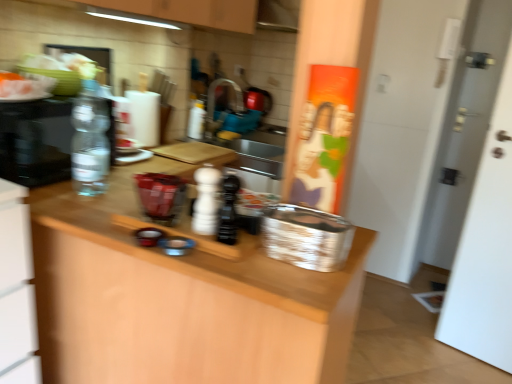
Measure the distance between white matte pepper shaker at center, arranged as the 2th bottle when viewed from the front, and camera.

A distance of 3.35 feet exists between white matte pepper shaker at center, arranged as the 2th bottle when viewed from the front, and camera.

What do you see at coordinates (306, 237) in the screenshot? The height and width of the screenshot is (384, 512). I see `silver metallic basket at center` at bounding box center [306, 237].

The height and width of the screenshot is (384, 512). In order to click on silver metallic basket at center in this screenshot , I will do point(306,237).

What is the approximate height of wooden at center?

The height of wooden at center is 92.17 centimeters.

I want to click on clear glass water bottle at left, so click(36, 141).

Where is `white matte pepper shaker at center, placed as the 3th bottle when sorted from back to front`? The image size is (512, 384). white matte pepper shaker at center, placed as the 3th bottle when sorted from back to front is located at coordinates (206, 200).

Looking at their sizes, would you say white matte pepper shaker at center, the second bottle positioned from the right, is wider or thinner than translucent plastic bottle at center, acting as the first bottle starting from the back?

white matte pepper shaker at center, the second bottle positioned from the right, is wider than translucent plastic bottle at center, acting as the first bottle starting from the back.

Is point (207, 177) farther from camera compared to point (193, 113)?

No, it is not.

From the image's perspective, which bottle is the 2nd one above the white matte pepper shaker at center, arranged as the 2th bottle when viewed from the front? Please provide its 2D coordinates.

[(196, 121)]

Measure the distance from white matte pepper shaker at center, placed as the 3th bottle when sorted from back to front, to translucent plastic bottle at center, arranged as the third bottle when viewed from the right.

white matte pepper shaker at center, placed as the 3th bottle when sorted from back to front, is 3.92 feet away from translucent plastic bottle at center, arranged as the third bottle when viewed from the right.

Considering the relative positions of silver metallic basket at center and wooden at center in the image provided, is silver metallic basket at center to the right of wooden at center from the viewer's perspective?

Yes.

Which of these two, silver metallic basket at center or wooden at center, stands shorter?

silver metallic basket at center.

Can we say silver metallic basket at center lies outside wooden at center?

Yes, silver metallic basket at center is outside of wooden at center.

Where is `basket above the wooden at center (from a real-world perspective)`? The image size is (512, 384). basket above the wooden at center (from a real-world perspective) is located at coordinates (306, 237).

From a real-world perspective, is translucent plastic bottle at center, which appears as the second bottle when viewed from the left, positioned above or below clear glass water bottle at left?

translucent plastic bottle at center, which appears as the second bottle when viewed from the left, is below clear glass water bottle at left.

Which object is wider, translucent plastic bottle at center, which appears as the second bottle when viewed from the left, or clear glass water bottle at left?

clear glass water bottle at left is wider.

At what (x,y) coordinates should I click in order to perform the action: click on the 2nd bottle behind when counting from the clear glass water bottle at left. Please return your answer as a coordinate pair (x, y). This screenshot has width=512, height=384. Looking at the image, I should click on (196, 121).

Can you confirm if transparent plastic bottle at left, acting as the third bottle starting from the front, is thinner than translucent plastic bottle at center, marked as the 4th bottle in a front-to-back arrangement?

No, transparent plastic bottle at left, acting as the third bottle starting from the front, is not thinner than translucent plastic bottle at center, marked as the 4th bottle in a front-to-back arrangement.

From a real-world perspective, relative to translucent plastic bottle at center, marked as the 4th bottle in a front-to-back arrangement, is transparent plastic bottle at left, which is the 2th bottle from back to front, vertically above or below?

Clearly, from a real-world perspective, transparent plastic bottle at left, which is the 2th bottle from back to front, is above translucent plastic bottle at center, marked as the 4th bottle in a front-to-back arrangement.

Is transparent plastic bottle at left, which ranks as the 1th bottle in left-to-right order, smaller than translucent plastic bottle at center, arranged as the third bottle when viewed from the right?

Actually, transparent plastic bottle at left, which ranks as the 1th bottle in left-to-right order, might be larger than translucent plastic bottle at center, arranged as the third bottle when viewed from the right.

Does black matte salt shaker at center, which appears as the 1th bottle when viewed from the right, have a lesser height compared to white matte pepper shaker at center, placed as the 3th bottle when sorted from back to front?

Yes, black matte salt shaker at center, which appears as the 1th bottle when viewed from the right, is shorter than white matte pepper shaker at center, placed as the 3th bottle when sorted from back to front.

Is black matte salt shaker at center, which is the 4th bottle in left-to-right order, facing away from white matte pepper shaker at center, arranged as the 3th bottle when viewed from the left?

That's not correct — black matte salt shaker at center, which is the 4th bottle in left-to-right order, is not looking away from white matte pepper shaker at center, arranged as the 3th bottle when viewed from the left.

Is point (233, 227) positioned behind point (195, 212)?

No, it is in front of (195, 212).

Measure the distance from black matte salt shaker at center, marked as the fourth bottle in a back-to-front arrangement, to white matte pepper shaker at center, arranged as the 3th bottle when viewed from the left.

2.46 inches.

Does clear glass water bottle at left have a larger size compared to translucent plastic bottle at center, marked as the 4th bottle in a front-to-back arrangement?

Yes.

Is clear glass water bottle at left oriented towards translucent plastic bottle at center, arranged as the third bottle when viewed from the right?

No, clear glass water bottle at left does not turn towards translucent plastic bottle at center, arranged as the third bottle when viewed from the right.

Is clear glass water bottle at left taller than translucent plastic bottle at center, arranged as the third bottle when viewed from the right?

Yes.

Is clear glass water bottle at left surrounding translucent plastic bottle at center, which appears as the second bottle when viewed from the left?

No.

What's the angular difference between silver metallic basket at center and clear glass water bottle at left's facing directions?

The facing directions of silver metallic basket at center and clear glass water bottle at left are 85.3 degrees apart.

From a real-world perspective, is silver metallic basket at center physically located above or below clear glass water bottle at left?

silver metallic basket at center is below clear glass water bottle at left.

Which object is more forward, silver metallic basket at center or clear glass water bottle at left?

Positioned in front is silver metallic basket at center.

Considering the relative sizes of silver metallic basket at center and clear glass water bottle at left in the image provided, is silver metallic basket at center bigger than clear glass water bottle at left?

No, silver metallic basket at center is not bigger than clear glass water bottle at left.

Where is `bottle that is the 1st one when counting leftward from the white matte pepper shaker at center, arranged as the 3th bottle when viewed from the left`? The image size is (512, 384). bottle that is the 1st one when counting leftward from the white matte pepper shaker at center, arranged as the 3th bottle when viewed from the left is located at coordinates [x=196, y=121].

I want to click on countertop that is below the silver metallic basket at center (from the image's perspective), so click(x=179, y=300).

From the picture: Looking at the image, which one is located closer to white matte pepper shaker at center, arranged as the 3th bottle when viewed from the left, translucent plastic bottle at center, arranged as the third bottle when viewed from the right, or black matte salt shaker at center, the first bottle positioned from the front?

Based on the image, black matte salt shaker at center, the first bottle positioned from the front, appears to be nearer to white matte pepper shaker at center, arranged as the 3th bottle when viewed from the left.

Looking at the image, which one is located closer to clear glass water bottle at left, silver metallic basket at center or black matte salt shaker at center, the first bottle positioned from the front?

The object closer to clear glass water bottle at left is black matte salt shaker at center, the first bottle positioned from the front.

When comparing their distances from transparent plastic bottle at left, which ranks as the 1th bottle in left-to-right order, does clear glass water bottle at left or silver metallic basket at center seem further?

silver metallic basket at center.

Considering their positions, is black matte salt shaker at center, marked as the fourth bottle in a back-to-front arrangement, positioned further to clear glass water bottle at left than transparent plastic bottle at left, which is the 4th bottle from right to left?

Based on the image, black matte salt shaker at center, marked as the fourth bottle in a back-to-front arrangement, appears to be further to clear glass water bottle at left.

Considering their positions, is silver metallic basket at center positioned closer to clear glass water bottle at left than white matte pepper shaker at center, placed as the 3th bottle when sorted from back to front?

Based on the image, white matte pepper shaker at center, placed as the 3th bottle when sorted from back to front, appears to be nearer to clear glass water bottle at left.

When comparing their distances from translucent plastic bottle at center, which appears as the second bottle when viewed from the left, does white matte pepper shaker at center, the second bottle positioned from the right, or silver metallic basket at center seem closer?

The object closer to translucent plastic bottle at center, which appears as the second bottle when viewed from the left, is white matte pepper shaker at center, the second bottle positioned from the right.

Looking at the image, which one is located closer to clear glass water bottle at left, translucent plastic bottle at center, arranged as the third bottle when viewed from the right, or silver metallic basket at center?

Based on the image, silver metallic basket at center appears to be nearer to clear glass water bottle at left.

Which object lies nearer to the anchor point transparent plastic bottle at left, which ranks as the 1th bottle in left-to-right order, wooden at center or translucent plastic bottle at center, acting as the first bottle starting from the back?

wooden at center is closer to transparent plastic bottle at left, which ranks as the 1th bottle in left-to-right order.

Identify the location of appliance positioned between black matte salt shaker at center, the first bottle positioned from the front, and translucent plastic bottle at center, marked as the 4th bottle in a front-to-back arrangement, from near to far. This screenshot has height=384, width=512. (36, 141).

You are a GUI agent. You are given a task and a screenshot of the screen. Output one action in this format:
    pyautogui.click(x=<x>, y=<y>)
    Task: Click on the countertop between clear glass water bottle at left and silver metallic basket at center from left to right
    The height and width of the screenshot is (384, 512).
    Given the screenshot: What is the action you would take?
    pyautogui.click(x=179, y=300)

You are a GUI agent. You are given a task and a screenshot of the screen. Output one action in this format:
    pyautogui.click(x=<x>, y=<y>)
    Task: Click on the bottle between white matte pepper shaker at center, arranged as the 3th bottle when viewed from the left, and wooden at center from top to bottom
    The width and height of the screenshot is (512, 384).
    Given the screenshot: What is the action you would take?
    pyautogui.click(x=228, y=211)

The image size is (512, 384). I want to click on appliance between wooden at center and translucent plastic bottle at center, which appears as the second bottle when viewed from the left, in the front-back direction, so [x=36, y=141].